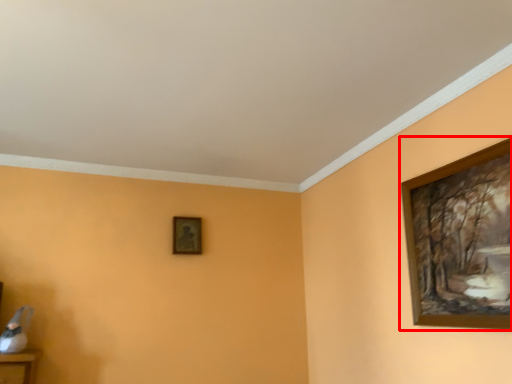
Question: From the image's perspective, what is the correct spatial positioning of picture frame (annotated by the red box) in reference to picture frame?

Choices:
 (A) above
 (B) below

Answer: (A)